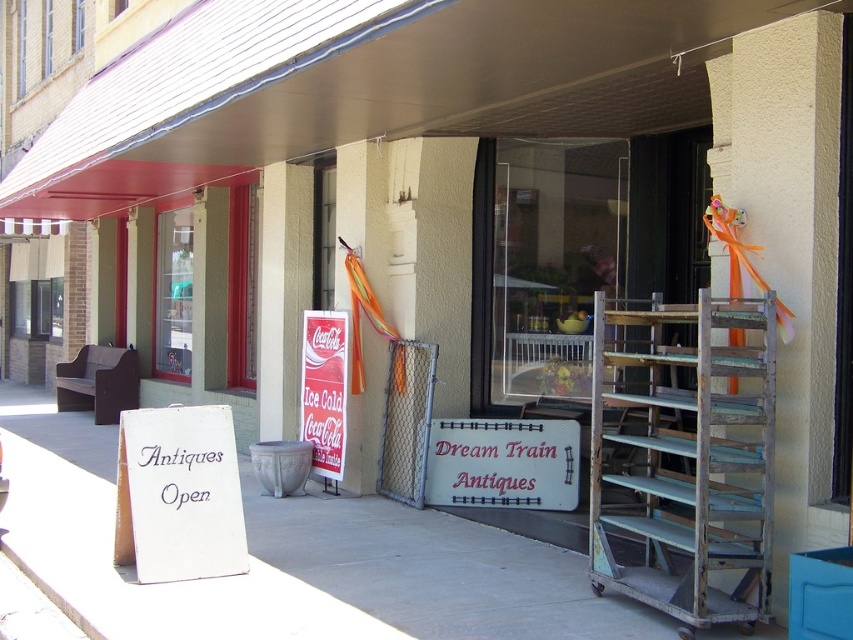
You are a delivery person trying to place a large box between the rusty metal ladder at right and the white wooden sign at center. Can you fit the box there if the box is 1.2 meters wide?

The rusty metal ladder at right is thinner than the white wooden sign at center, but the exact width difference isn not specified. Without knowing the actual widths, it is impossible to determine if the space between them is sufficient for a 1.2 meter wide box.